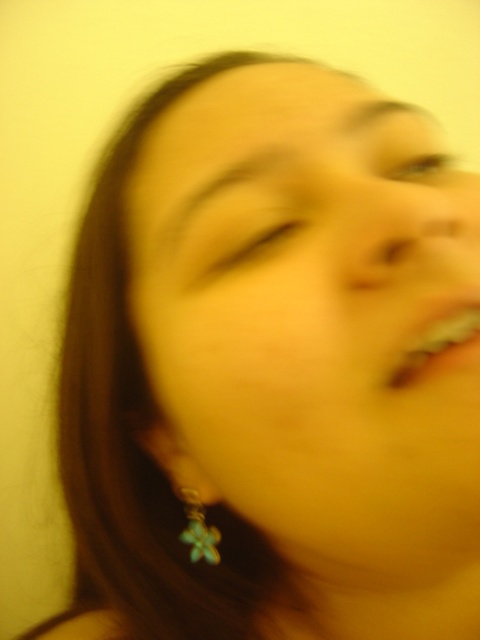
Question: Where is matte gold earring at center located in relation to matte yellow eye at center in the image?

Choices:
 (A) right
 (B) left

Answer: (A)

Question: Is matte gold earring at center bigger than matte black eye at upper right?

Choices:
 (A) yes
 (B) no

Answer: (A)

Question: Which of the following is the farthest from the observer?

Choices:
 (A) tap(195, 237)
 (B) tap(151, 380)
 (C) tap(406, 353)

Answer: (B)

Question: Which of these objects is positioned farthest from the matte black eye at upper right?

Choices:
 (A) matte pink lips at center
 (B) green flower-shaped earring at lower left

Answer: (B)

Question: Is matte yellow eye at center further to the viewer compared to green flower-shaped earring at lower left?

Choices:
 (A) yes
 (B) no

Answer: (B)

Question: Which of these objects is positioned farthest from the matte pink lips at center?

Choices:
 (A) green flower-shaped earring at lower left
 (B) matte black eye at upper right

Answer: (A)